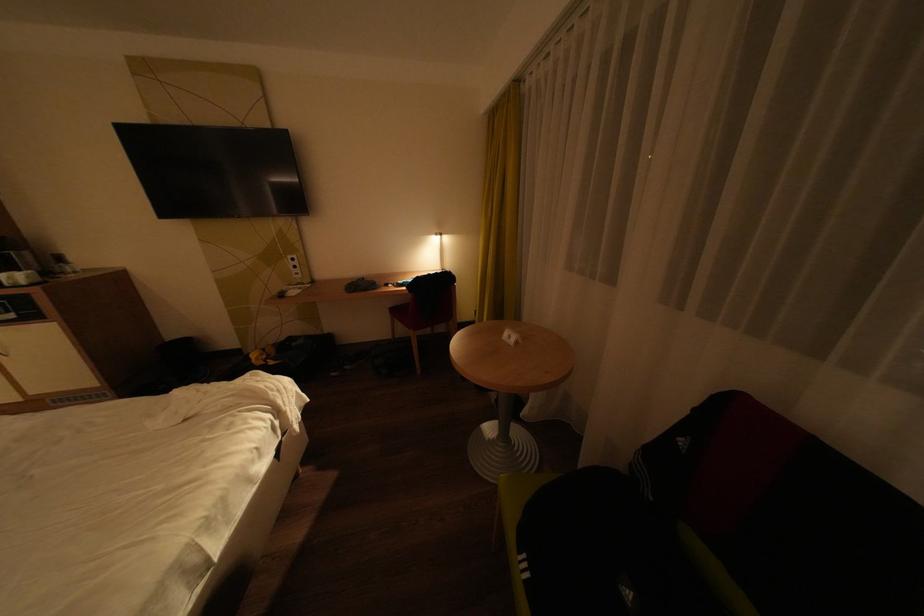
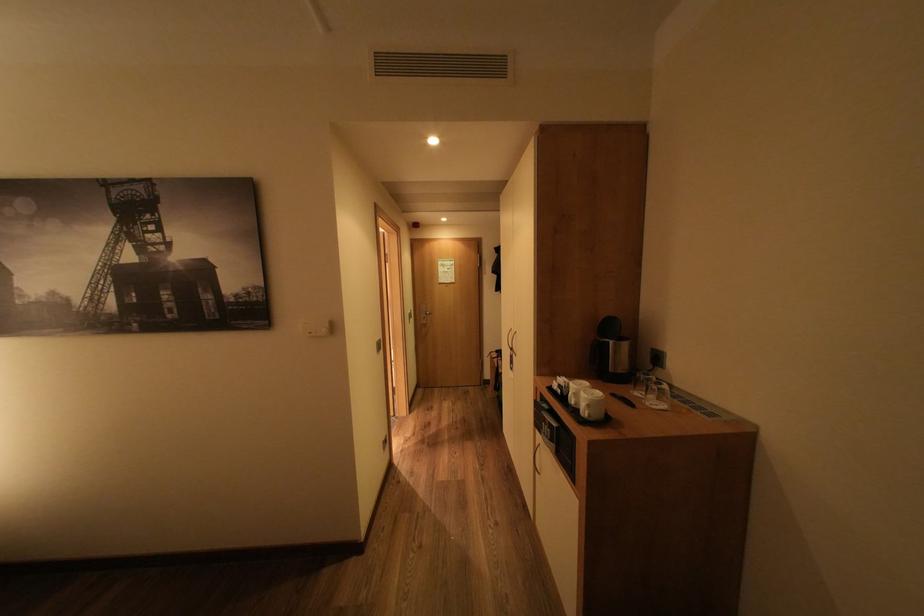
In the second image, find the point that corresponds to the point at 38,277 in the first image.

(600, 406)